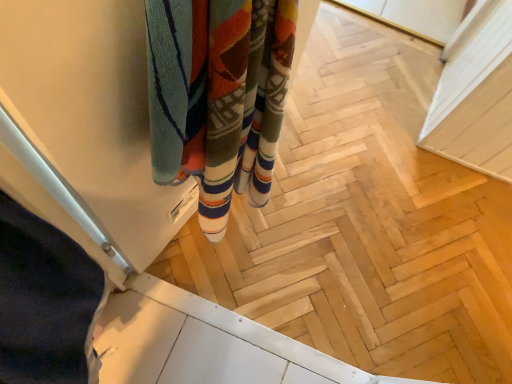
Identify the location of textured woolen blanket at upper left. (218, 97).

What do you see at coordinates (218, 97) in the screenshot? The height and width of the screenshot is (384, 512). I see `textured woolen blanket at upper left` at bounding box center [218, 97].

What is the approximate width of textured woolen blanket at upper left?

The width of textured woolen blanket at upper left is 5.47 inches.

Measure the distance between point (176,54) and camera.

A distance of 16.69 inches exists between point (176,54) and camera.

Measure the distance between textured woolen blanket at upper left and camera.

The distance of textured woolen blanket at upper left from camera is 14.66 inches.

Where is `textured woolen blanket at upper left`? textured woolen blanket at upper left is located at coordinates (218, 97).